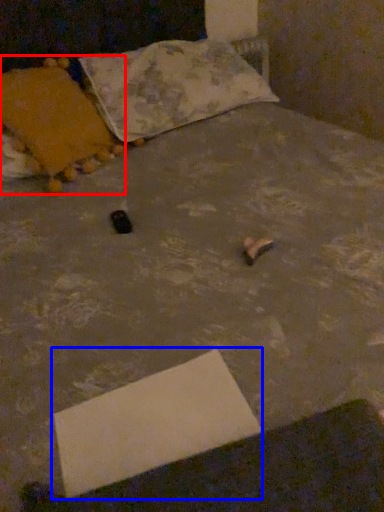
Question: Which of the following is the farthest to the observer, pillow (highlighted by a red box) or cardboard box (highlighted by a blue box)?

Choices:
 (A) pillow
 (B) cardboard box

Answer: (A)